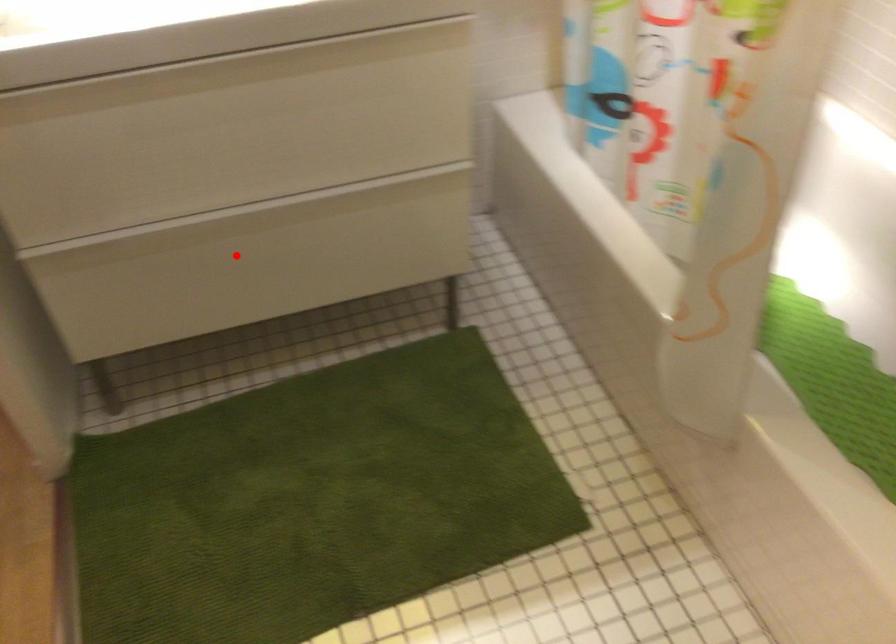
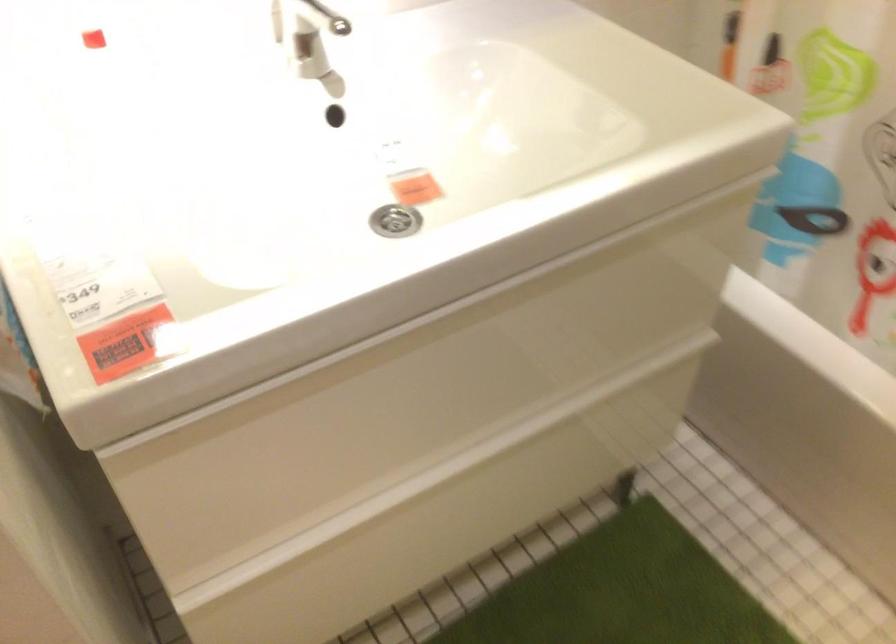
Question: I am providing you with two images of the same scene from different viewpoints. A red point is shown in image1. For the corresponding object point in image2, is it positioned nearer or farther from the camera?

Choices:
 (A) Nearer
 (B) Farther

Answer: (A)